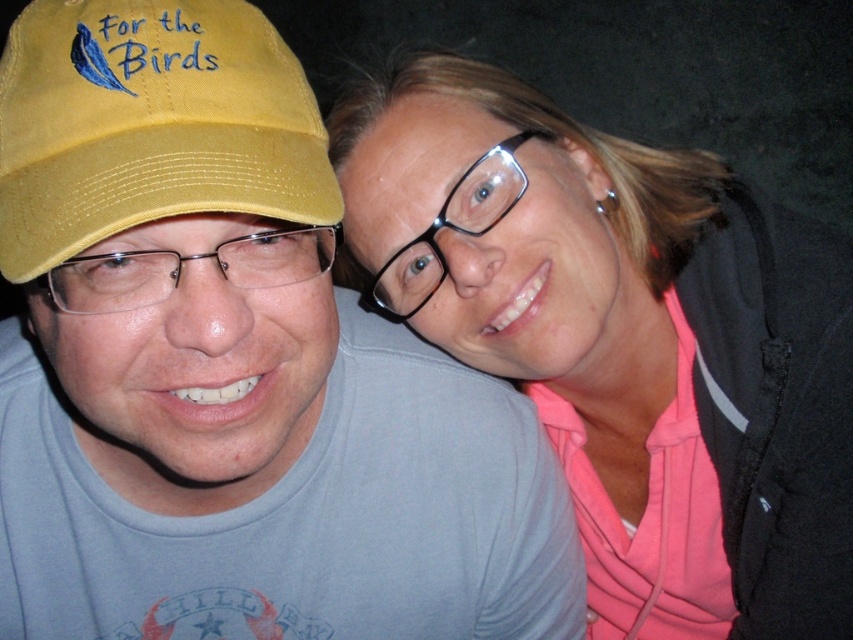
Is point (399, 538) more distant than point (30, 259)?

Yes, it is.

Measure the distance between point (230, 99) and camera.

Point (230, 99) is 19.14 inches away from camera.

Does point (234, 92) lie behind point (131, 168)?

Yes, it is.

At what (x,y) coordinates should I click in order to perform the action: click on matte yellow cap at left. Please return your answer as a coordinate pair (x, y). Looking at the image, I should click on (231, 369).

Is pink fabric at upper right to the right of yellow fabric cap at left from the viewer's perspective?

Correct, you'll find pink fabric at upper right to the right of yellow fabric cap at left.

What do you see at coordinates (625, 339) in the screenshot? I see `pink fabric at upper right` at bounding box center [625, 339].

Who is more forward, [682,196] or [62,76]?

Point [62,76] is in front.

Locate an element on the screen. Image resolution: width=853 pixels, height=640 pixels. pink fabric at upper right is located at coordinates (625, 339).

Which is above, matte yellow cap at left or pink fabric at upper right?

pink fabric at upper right is higher up.

Measure the distance between matte yellow cap at left and pink fabric at upper right.

matte yellow cap at left is 17.97 centimeters away from pink fabric at upper right.

Is point (252, 22) less distant than point (819, 552)?

Yes.

Locate an element on the screen. The width and height of the screenshot is (853, 640). matte yellow cap at left is located at coordinates (231, 369).